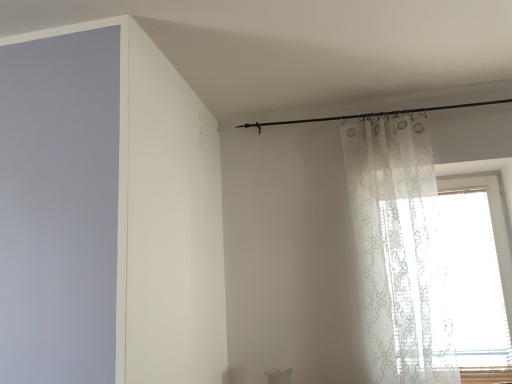
Question: Would you say translucent white curtain at upper right is to the left or to the right of sheer white curtain at right in the picture?

Choices:
 (A) right
 (B) left

Answer: (B)

Question: Does point (376, 163) appear closer or farther from the camera than point (464, 326)?

Choices:
 (A) closer
 (B) farther

Answer: (A)

Question: Relative to sheer white curtain at right, is translucent white curtain at upper right in front or behind?

Choices:
 (A) behind
 (B) front

Answer: (B)

Question: Considering their positions, is sheer white curtain at right located in front of or behind translucent white curtain at upper right?

Choices:
 (A) behind
 (B) front

Answer: (A)

Question: Is sheer white curtain at right bigger or smaller than translucent white curtain at upper right?

Choices:
 (A) big
 (B) small

Answer: (A)

Question: Does point (459, 244) appear closer or farther from the camera than point (437, 279)?

Choices:
 (A) farther
 (B) closer

Answer: (A)

Question: Is sheer white curtain at right situated inside translucent white curtain at upper right or outside?

Choices:
 (A) inside
 (B) outside

Answer: (B)